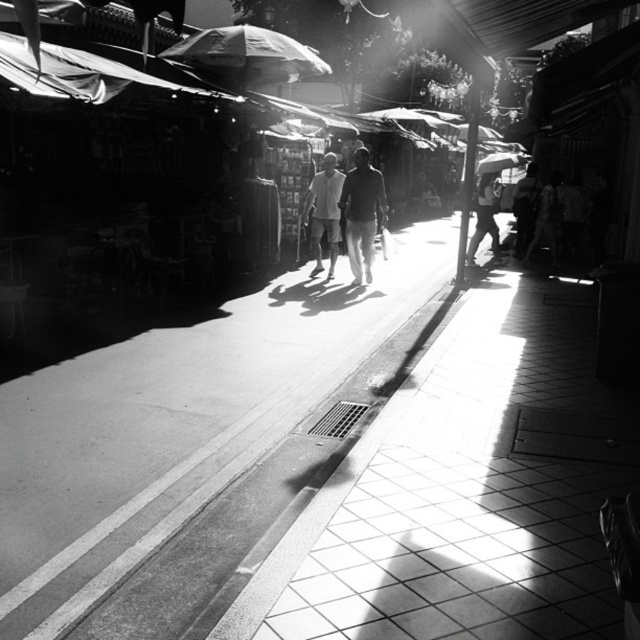
Based on the provided scene description, where is the smooth skin person at center located in terms of coordinates?

The smooth skin person at center is located at coordinates point (484, 218).

You are a photographer standing at the end of the street market. You want to take a photo of the smooth skin person at center and the white fabric umbrella at upper center. Which object is narrower in the photo?

The smooth skin person at center is thinner than the white fabric umbrella at upper center, so the smooth skin person at center is narrower in the photo.

You are standing at the camera position looking down the street. There are two points marked on the image. The first point is at coordinates point (300, 413) and the second is at point (259, 83). Which point is closer to you?

Point (300, 413) is closer to the camera than point (259, 83).